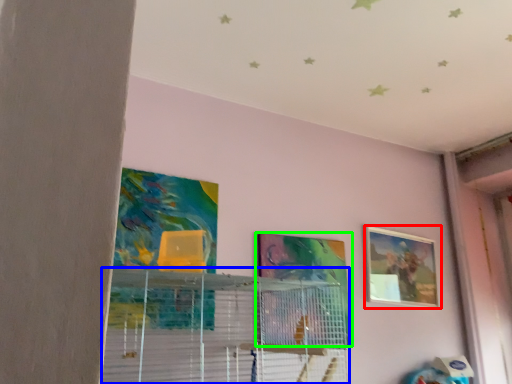
Question: Which object is positioned closest to picture frame (highlighted by a red box)? Select from shelf (highlighted by a blue box) and picture frame (highlighted by a green box).

Choices:
 (A) shelf
 (B) picture frame

Answer: (B)